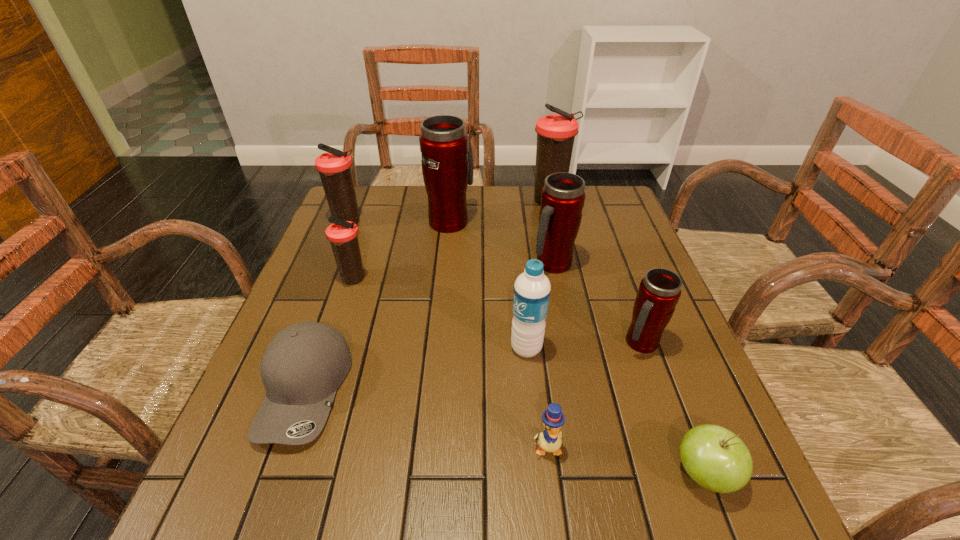
Where is `baseball cap`? The image size is (960, 540). baseball cap is located at coordinates (304, 364).

At what (x,y) coordinates should I click in order to perform the action: click on apple. Please return your answer as a coordinate pair (x, y). This screenshot has width=960, height=540. Looking at the image, I should click on (714, 457).

The image size is (960, 540). What are the coordinates of `duckling` in the screenshot? It's located at coord(549,440).

Where is `vacant region located on the right of the biggest brown thermos bottle`? vacant region located on the right of the biggest brown thermos bottle is located at coordinates (x=592, y=201).

Image resolution: width=960 pixels, height=540 pixels. I want to click on free space located on the side with the handle of the farthest red thermos bottle, so click(453, 186).

At what (x,y) coordinates should I click in order to perform the action: click on free space located 0.100m on the side with the handle of the farthest red thermos bottle. Please return your answer as a coordinate pair (x, y). Image resolution: width=960 pixels, height=540 pixels. Looking at the image, I should click on (453, 191).

I want to click on vacant space located on the right of the second smallest brown thermos bottle, so click(406, 222).

The height and width of the screenshot is (540, 960). Find the location of `free space located on the side with the handle of the second biggest red thermos bottle`. free space located on the side with the handle of the second biggest red thermos bottle is located at coordinates (564, 322).

The height and width of the screenshot is (540, 960). I want to click on free region located 0.200m on the label of the water bottle, so click(417, 348).

Image resolution: width=960 pixels, height=540 pixels. What are the coordinates of `free space located on the label of the water bottle` in the screenshot? It's located at (332, 348).